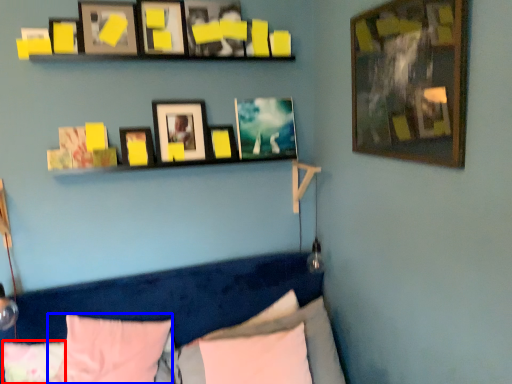
Question: Which point is further to the camera, pillow (highlighted by a red box) or pillow (highlighted by a blue box)?

Choices:
 (A) pillow
 (B) pillow

Answer: (A)